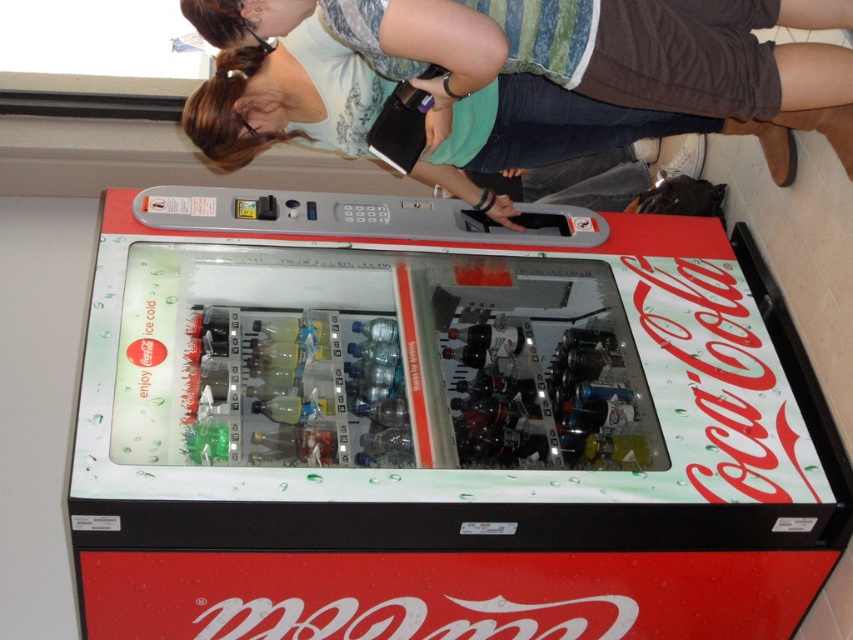
From the picture: You are standing in front of the Coca Cola vending machine and notice two points marked on its surface. The first point is at coordinate (x=740, y=442) and the second is at (x=740, y=45). Which point is closer to you?

Point (x=740, y=442) is further to the viewer than point (x=740, y=45), so the point closer to you is point (x=740, y=45).

You are standing in front of the Coca Cola vending machine and notice two items in the image. One is the metallic silver vending machine at center and the other is the matte green shirt at upper center. Based on their positions, which one is located higher up?

The matte green shirt at upper center is located higher up than the metallic silver vending machine at center.

You are standing in front of the Coca Cola vending machine and notice both the metallic silver vending machine at center and the matte green shirt at upper center. Which object is taller?

The metallic silver vending machine at center is taller than the matte green shirt at upper center.